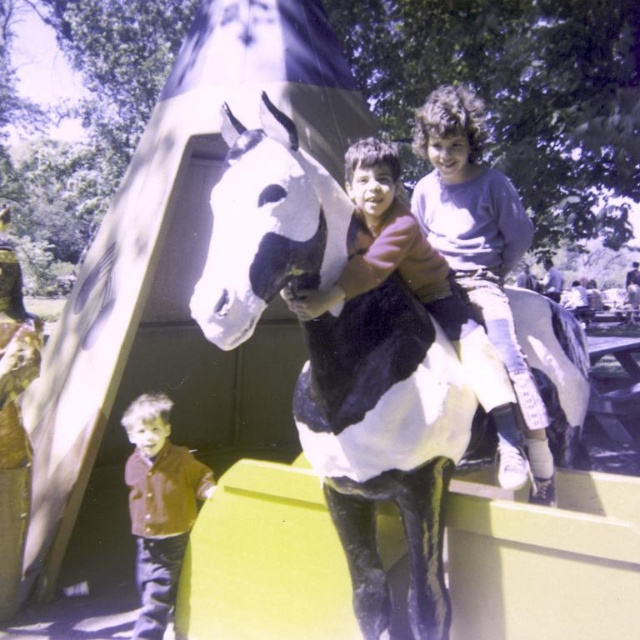
Question: Which point is farther from the camera taking this photo?

Choices:
 (A) (365, 141)
 (B) (504, 333)

Answer: (B)

Question: Can you confirm if purple cotton shirt at upper right is positioned to the left of brown velvet jacket at lower left?

Choices:
 (A) no
 (B) yes

Answer: (A)

Question: Which of these objects is positioned farthest from the purple cotton shirt at upper right?

Choices:
 (A) matte black horse at center
 (B) white matte horse at center
 (C) brown velvet jacket at lower left

Answer: (C)

Question: Is purple cotton shirt at upper right further to the viewer compared to matte black horse at center?

Choices:
 (A) no
 (B) yes

Answer: (B)

Question: Does white matte horse at center have a lesser width compared to matte black horse at center?

Choices:
 (A) yes
 (B) no

Answer: (B)

Question: Estimate the real-world distances between objects in this image. Which object is farther from the white matte horse at center?

Choices:
 (A) purple cotton shirt at upper right
 (B) brown velvet jacket at lower left

Answer: (B)